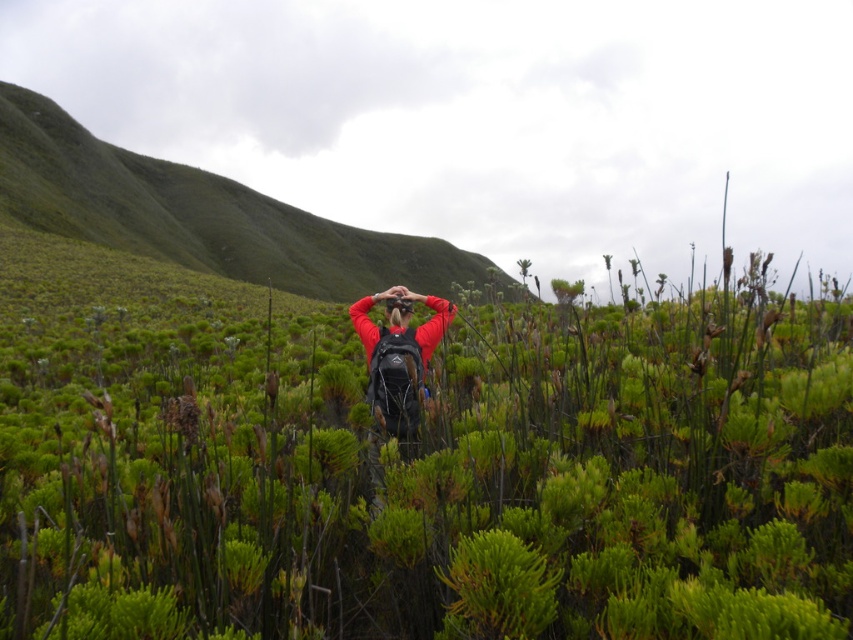
Is green grassy hillside at upper left shorter than matte black backpack at center?

No.

Describe the element at coordinates (204, 216) in the screenshot. I see `green grassy hillside at upper left` at that location.

Is point (146, 182) positioned after point (405, 355)?

That is True.

At what (x,y) coordinates should I click in order to perform the action: click on green grassy hillside at upper left. Please return your answer as a coordinate pair (x, y). The height and width of the screenshot is (640, 853). Looking at the image, I should click on (204, 216).